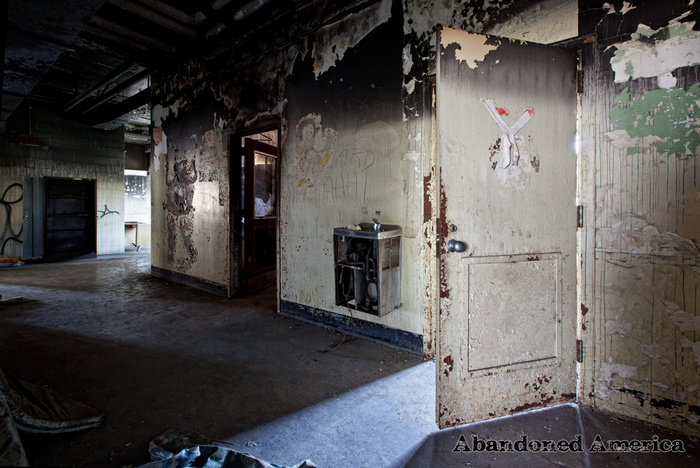
I want to click on ceiling, so click(x=108, y=41).